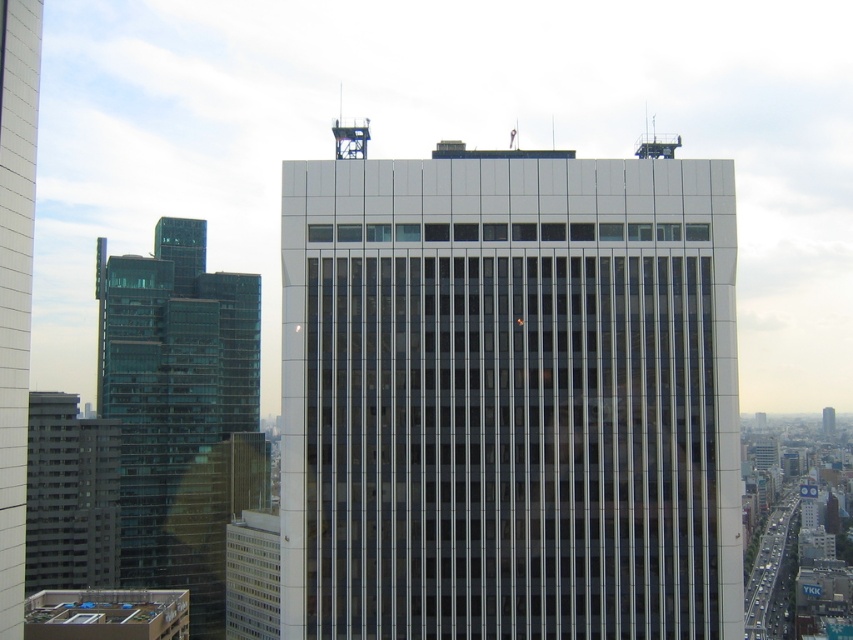
You are a drone operator tasked with flying a drone between the white glass building at center and the transparent glass building at left. The drone has a maximum flight distance of 600 feet. Can you safely fly the drone between these two buildings without exceeding its range?

The distance between the white glass building at center and the transparent glass building at left is 595.32 feet, which is within the drone operator maximum flight range of 600 feet. Yes, the drone can safely fly between them without exceeding its range.

You are standing at the origin point of the city map. The glassy reflective skyscraper at center is located at coordinates 0.447, 0.019. If you want to reach it, which direction should you head?

The glassy reflective skyscraper at center is located at coordinates (15,285). Since the x coordinate is positive, you should head east.

You are standing at a viewpoint where you can see the glassy reflective skyscraper at center and the transparent glass windows at lower left. Which of these two objects is positioned to the left?

The glassy reflective skyscraper at center is positioned to the left of the transparent glass windows at lower left.